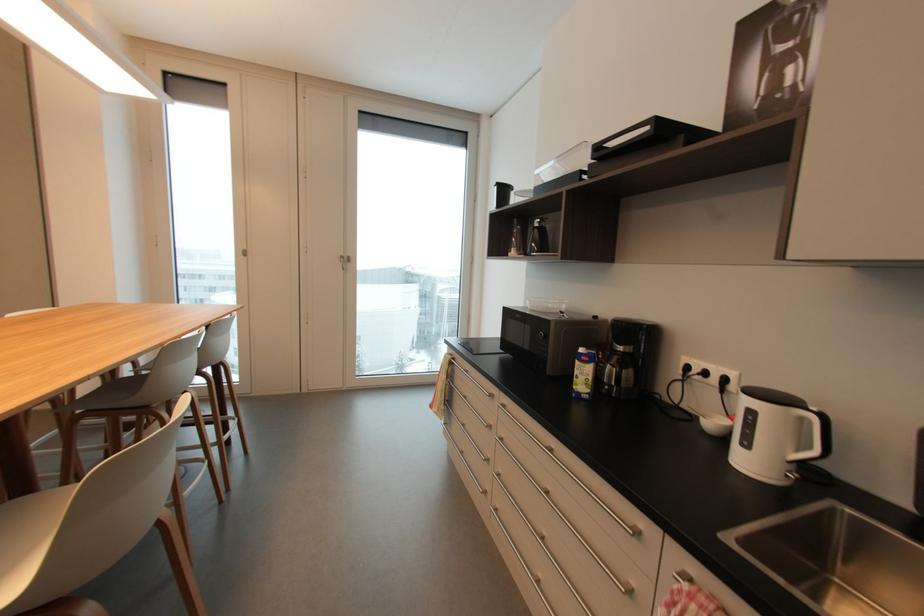
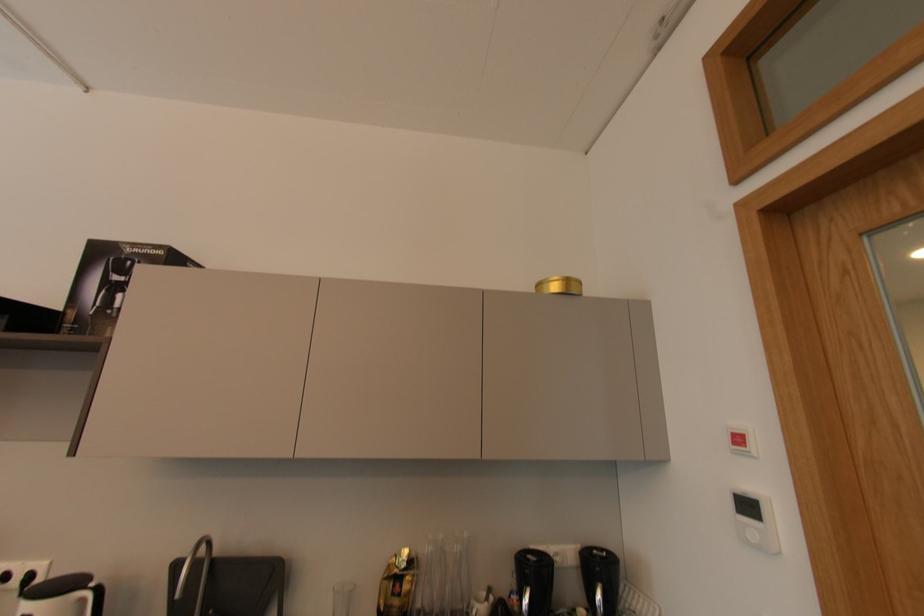
Question: How did the camera likely rotate?

Choices:
 (A) Left
 (B) Right
 (C) Up
 (D) Down

Answer: (B)